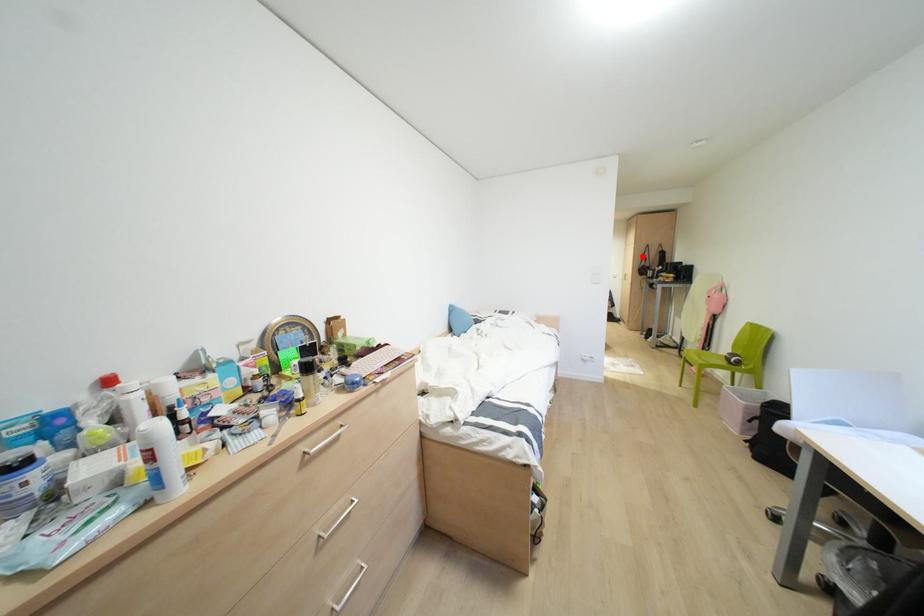
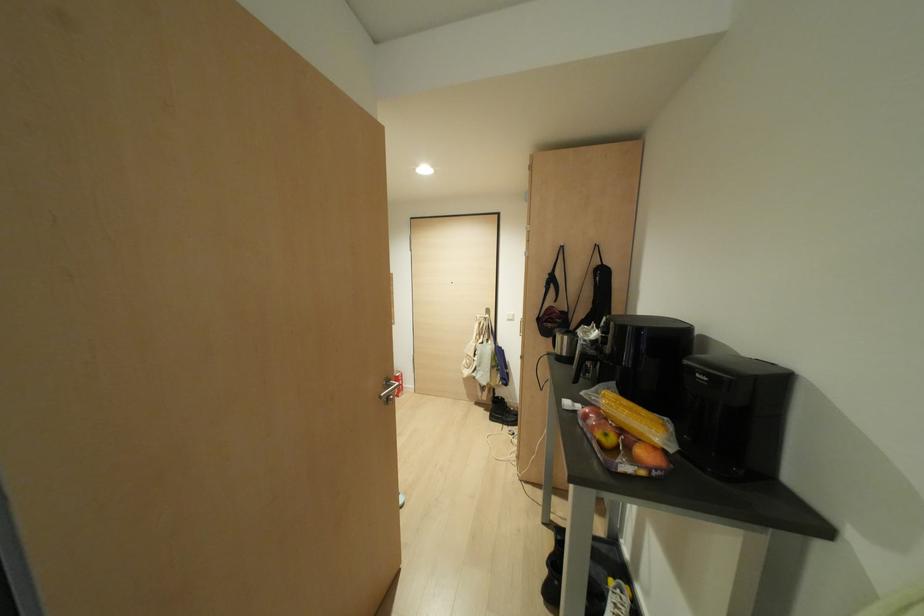
Where in the second image is the point corresponding to the highlighted location from the first image?

(551, 280)